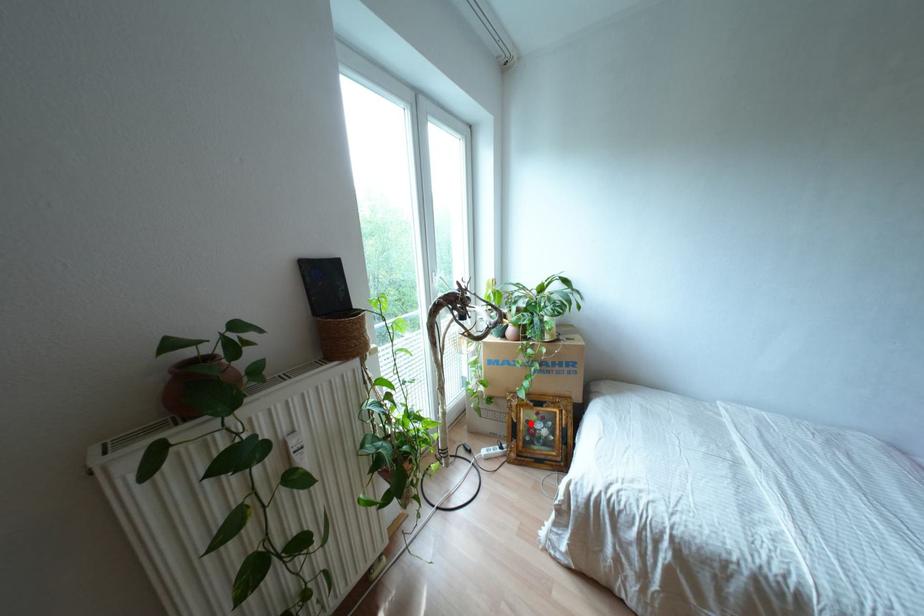
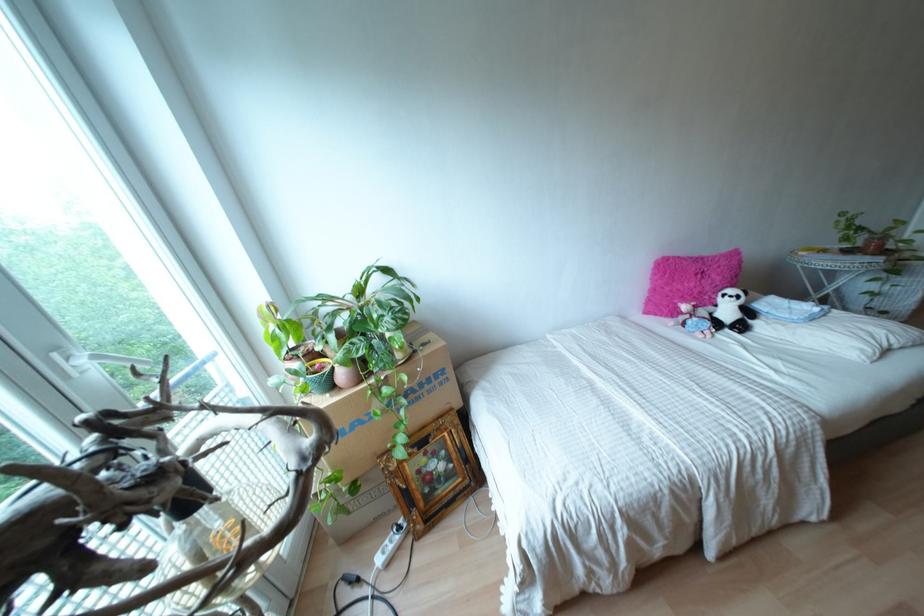
Locate, in the second image, the point that corresponds to the highlighted location in the first image.

(423, 469)